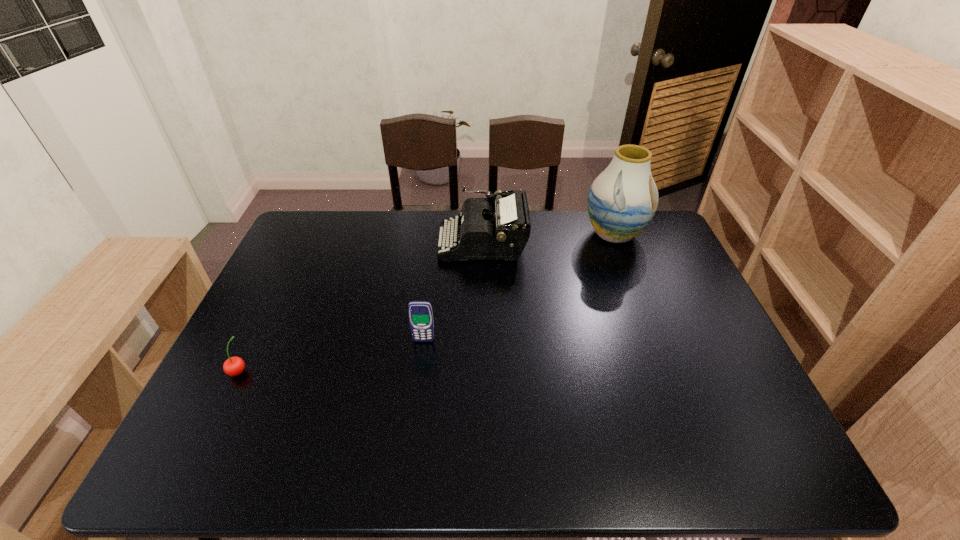
Choose which object is the nearest neighbor to the rightmost object. Please provide its 2D coordinates. Your answer should be formatted as a tuple, i.e. [(x, y)], where the tuple contains the x and y coordinates of a point satisfying the conditions above.

[(487, 233)]

In order to click on free location that satisfies the following two spatial constraints: 1. on the typing side of the typewriter; 2. on the front-facing side of the third farthest object in this screenshot , I will do `click(484, 341)`.

At what (x,y) coordinates should I click in order to perform the action: click on vacant point that satisfies the following two spatial constraints: 1. on the typing side of the typewriter; 2. on the front-facing side of the third farthest object. Please return your answer as a coordinate pair (x, y). Looking at the image, I should click on (484, 341).